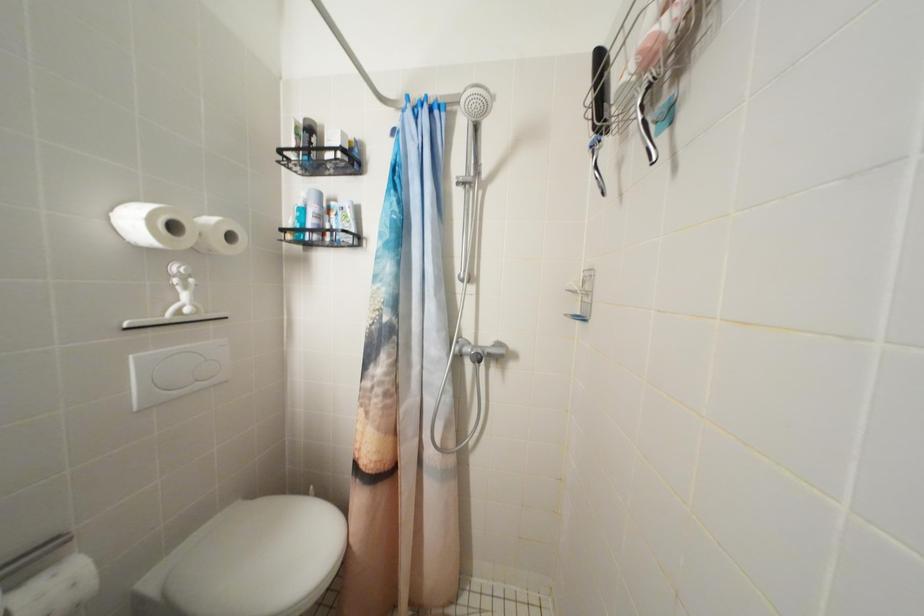
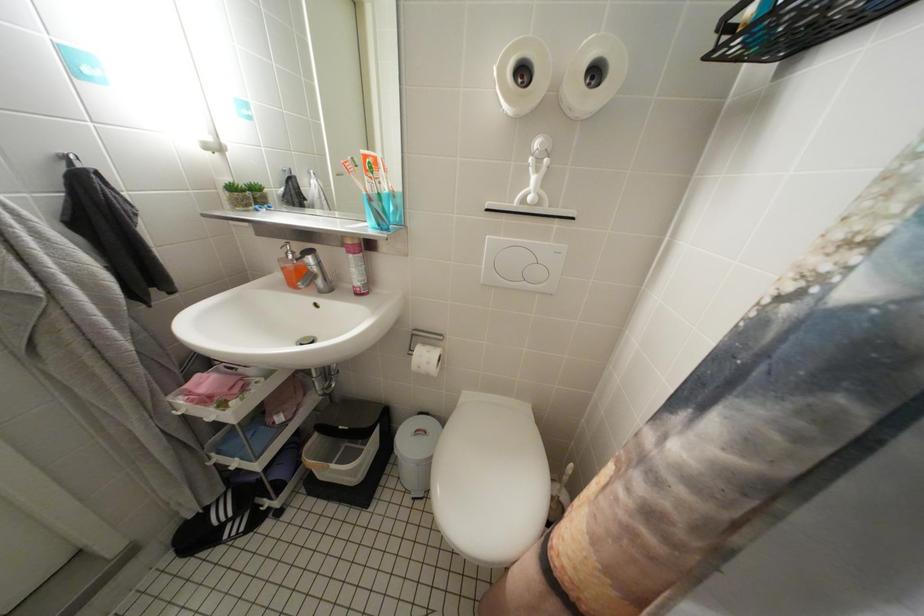
The first image is from the beginning of the video and the second image is from the end. How did the camera likely rotate when shooting the video?

The rotation direction of the camera is left-down.